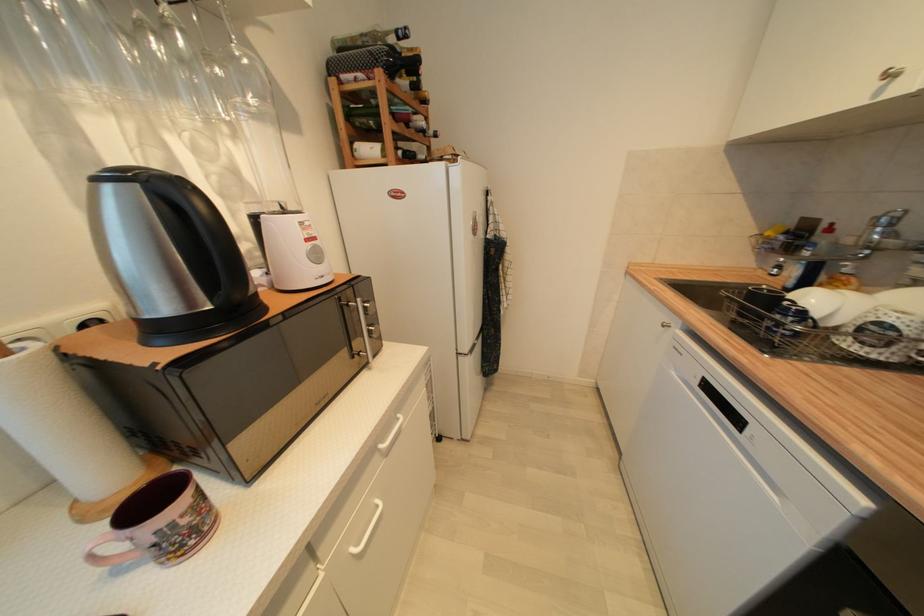
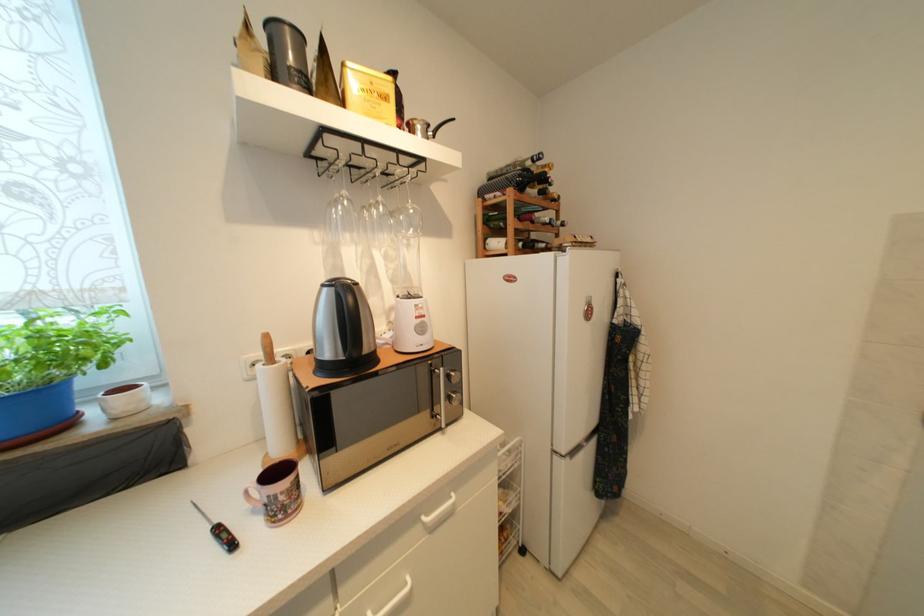
In the second image, find the point that corresponds to pixel 385 448 in the first image.

(429, 521)